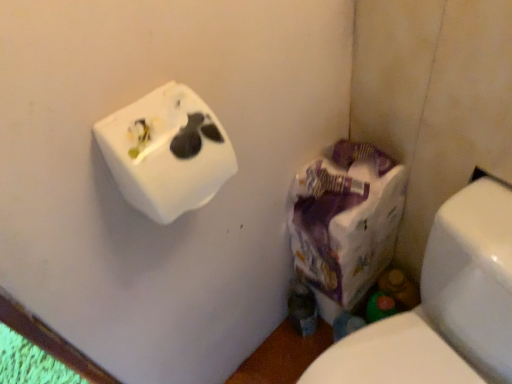
Question: From the image's perspective, relative to purple paper bag at lower right, is white glossy toilet at lower right above or below?

Choices:
 (A) above
 (B) below

Answer: (B)

Question: From a real-world perspective, is white glossy toilet at lower right above or below purple paper bag at lower right?

Choices:
 (A) above
 (B) below

Answer: (B)

Question: Which is nearer to the white matte tissue box at upper left?

Choices:
 (A) white glossy toilet at lower right
 (B) purple paper bag at lower right

Answer: (B)

Question: Based on their relative distances, which object is farther from the white glossy toilet at lower right?

Choices:
 (A) purple paper bag at lower right
 (B) white matte tissue box at upper left

Answer: (B)